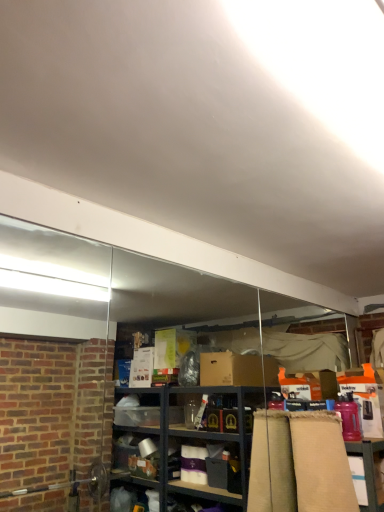
Question: From a real-world perspective, is beige fabric at right physically located above or below matte cardboard table at lower right?

Choices:
 (A) below
 (B) above

Answer: (B)

Question: Is beige fabric at right taller or shorter than matte cardboard table at lower right?

Choices:
 (A) tall
 (B) short

Answer: (A)

Question: Considering the positions of beige fabric at right and matte cardboard table at lower right in the image, is beige fabric at right wider or thinner than matte cardboard table at lower right?

Choices:
 (A) wide
 (B) thin

Answer: (A)

Question: From their relative heights in the image, would you say matte cardboard table at lower right is taller or shorter than beige fabric at right?

Choices:
 (A) tall
 (B) short

Answer: (B)

Question: Visually, is matte cardboard table at lower right positioned to the left or to the right of beige fabric at right?

Choices:
 (A) left
 (B) right

Answer: (B)

Question: Is point (360, 503) positioned closer to the camera than point (326, 508)?

Choices:
 (A) farther
 (B) closer

Answer: (A)

Question: From a real-world perspective, is matte cardboard table at lower right physically located above or below beige fabric at right?

Choices:
 (A) below
 (B) above

Answer: (A)